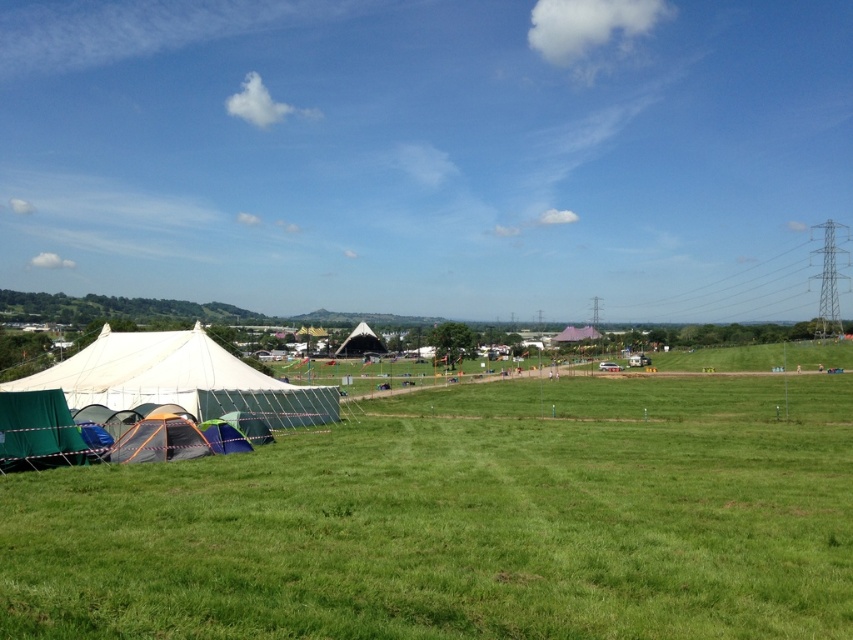
Is blue fabric tent at lower left in front of white canvas tent at center?

Yes, it is in front of white canvas tent at center.

Is blue fabric tent at lower left shorter than white canvas tent at center?

→ Correct, blue fabric tent at lower left is not as tall as white canvas tent at center.

What do you see at coordinates (224, 436) in the screenshot? I see `blue fabric tent at lower left` at bounding box center [224, 436].

Where is `blue fabric tent at lower left`? This screenshot has height=640, width=853. blue fabric tent at lower left is located at coordinates (224, 436).

Does white canvas tent at left have a greater height compared to blue fabric tent at lower left?

Yes.

Who is lower down, white canvas tent at left or blue fabric tent at lower left?

blue fabric tent at lower left is below.

Where is `white canvas tent at left`? This screenshot has height=640, width=853. white canvas tent at left is located at coordinates (152, 387).

Who is shorter, green grassy field at lower left or white canvas tent at left?

With less height is green grassy field at lower left.

Is point (572, 541) positioned before point (199, 337)?

Yes, it is.

Is point (531, 518) positioned behind point (337, 410)?

No, it is not.

This screenshot has width=853, height=640. I want to click on green grassy field at lower left, so click(x=463, y=522).